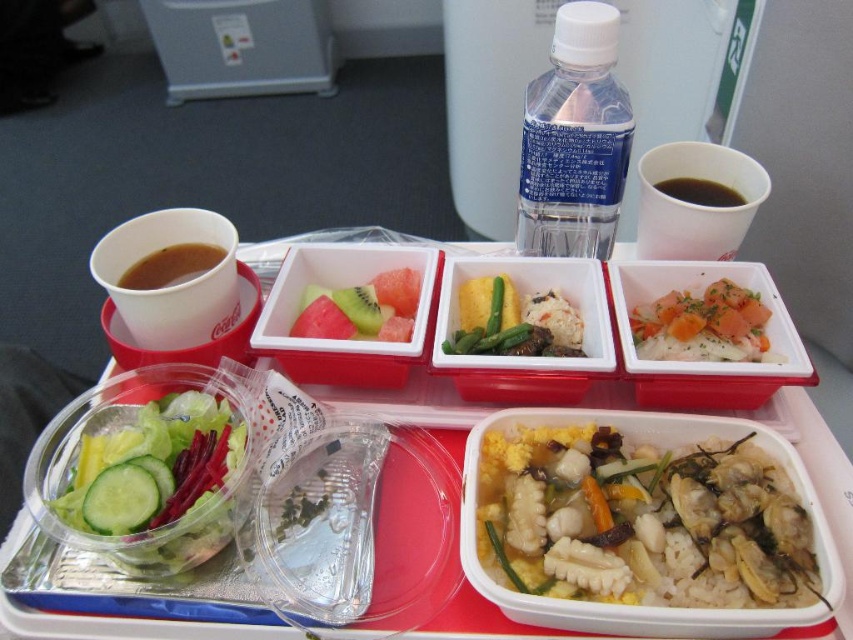
You are a flight attendant checking the meal tray. You need to place a new snack between the translucent plastic salad bowl at lower left and the white rice with carrot and herbs at center right. Based on their current positions, where should you place the snack?

The snack should be placed between the translucent plastic salad bowl at lower left and the white rice with carrot and herbs at center right, as the salad bowl is positioned to the left of the rice container.

You are a flight attendant checking the meal tray. The airline requires that all food items must be within 20 inches of the viewer for easy access. Is the green matte green beans at center positioned within the required distance?

The green matte green beans at center are 20.29 inches away from the viewer, which exceeds the airline requirement of 20 inches. Therefore, they are positioned outside the required distance.

You are a passenger seated at an airplane seat and want to reach the point marked at coordinates point (506, 298) on the meal tray. Can you safely reach it without disturbing the other items on the tray?

The point marked at coordinates point (506, 298) is 58.46 centimeters away from the viewer, so yes, you can safely reach it without disturbing the other items on the tray since it is within a comfortable reach distance.